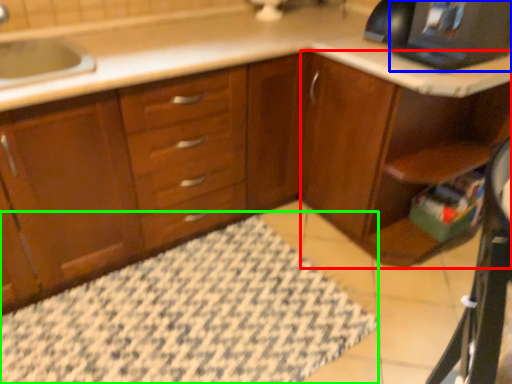
Question: Which object is positioned farthest from dresser (highlighted by a red box)? Select from desktop computer (highlighted by a blue box) and bath mat (highlighted by a green box).

Choices:
 (A) desktop computer
 (B) bath mat

Answer: (B)